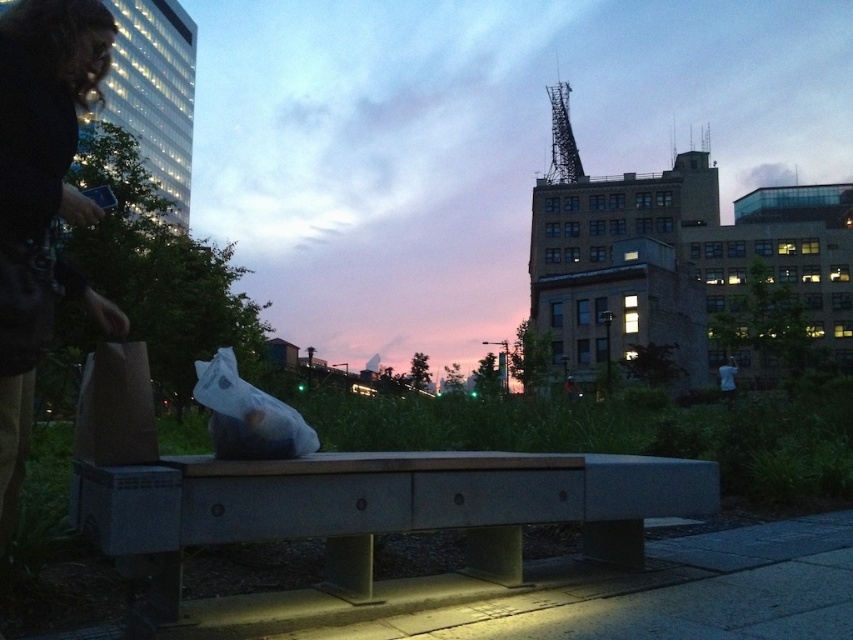
You are a city planner analyzing this area. You need to determine if the concrete bench at center can be moved closer to the metallic structure at upper right without overlapping. Based on their sizes, is this feasible?

The concrete bench at center occupies less space than metallic structure at upper right. Since the bench is smaller, it can be moved closer to the metallic structure at upper right without overlapping.

From the picture: You are standing at the point labeled as point (380, 508) in the image. What object are you standing on?

You are standing on the concrete bench at center, as the point (380, 508) represents its location.